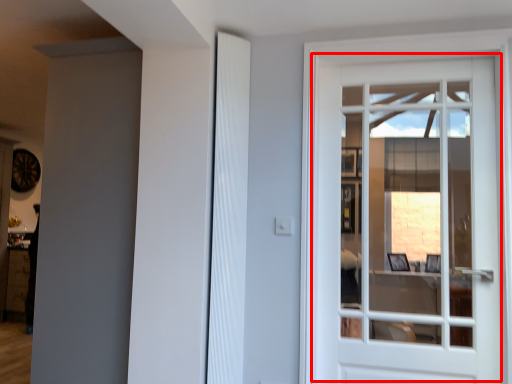
Question: From the image's perspective, what is the correct spatial relationship of door (annotated by the red box) in relation to shutter?

Choices:
 (A) below
 (B) above

Answer: (A)